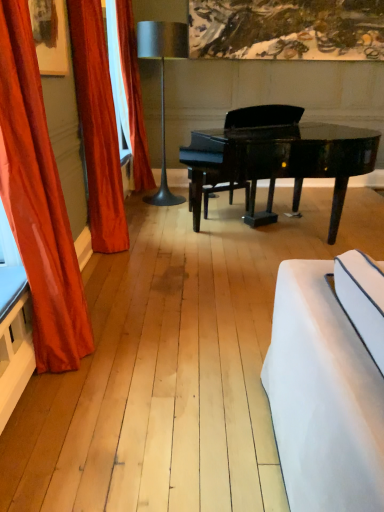
Identify the location of free spot to the right of satin orange curtain at left, which is the third curtain in back-to-front order. tap(147, 349).